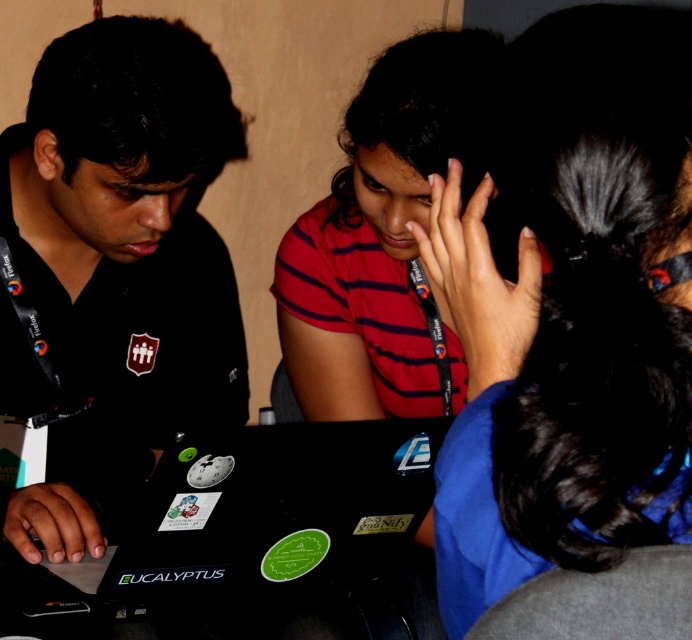
You are a photographer who needs to capture a clear shot of the black matte laptop at center without the black matte shirt at left blocking it. Based on their positions, can you adjust your angle to avoid the obstruction?

The black matte laptop at center is behind the black matte shirt at left, so adjusting the angle to look around or above the shirt should allow you to capture the laptop without obstruction.

You are a photographer standing behind the table and want to take a photo of both the black matte shirt at left and the black matte laptop at center. Which object should you focus on first if you want to ensure both are in focus without moving the camera?

The black matte shirt at left is taller than the black matte laptop at center, so focusing on the black matte shirt at left first would ensure both are in focus since it is the larger object in the frame.

Based on the photo, you are a photographer positioned at the origin point of the image. You need to capture a photo of the red striped shirt at center. Which direction should you move your camera to focus on it?

The red striped shirt at center is located at point 0.370 in the x and 0.559 in the y coordinates. Since the origin is at the bottom left corner, you should move your camera to the right and upwards to focus on the red striped shirt at center.